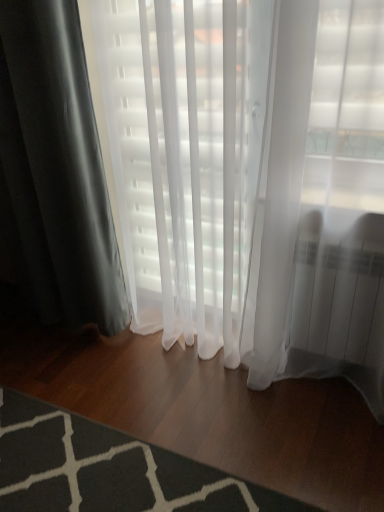
Locate an element on the screen. Image resolution: width=384 pixels, height=512 pixels. vacant space in dark gray textured rug at lower left (from a real-world perspective) is located at coordinates (80, 468).